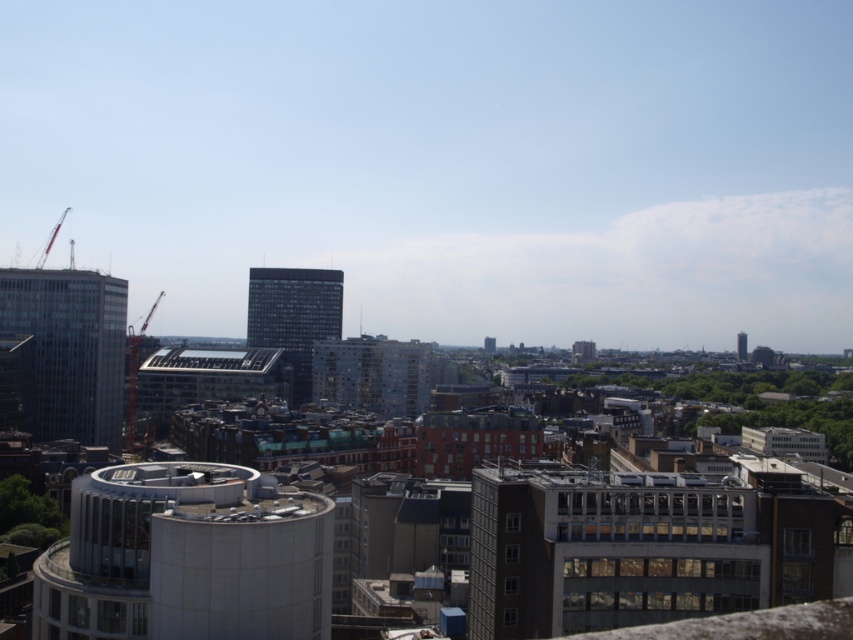
Which is behind, point (709, 516) or point (56, 230)?

The point (56, 230) is behind.

Is point (624, 548) farther from camera compared to point (67, 205)?

No.

Where is `light brown glass building at center`? This screenshot has height=640, width=853. light brown glass building at center is located at coordinates (606, 550).

Which is behind, point (39, 636) or point (338, 326)?

The point (338, 326) is more distant.

Between point (198, 582) and point (287, 300), which one is positioned behind?

Positioned behind is point (287, 300).

Where is `white smooth tower at lower left`? white smooth tower at lower left is located at coordinates (186, 557).

Is white smooth tower at lower left smaller than metallic construction crane at left?

Yes.

Between point (230, 532) and point (134, 380), which one is positioned behind?

Positioned behind is point (134, 380).

What are the coordinates of `white smooth tower at lower left` in the screenshot? It's located at (186, 557).